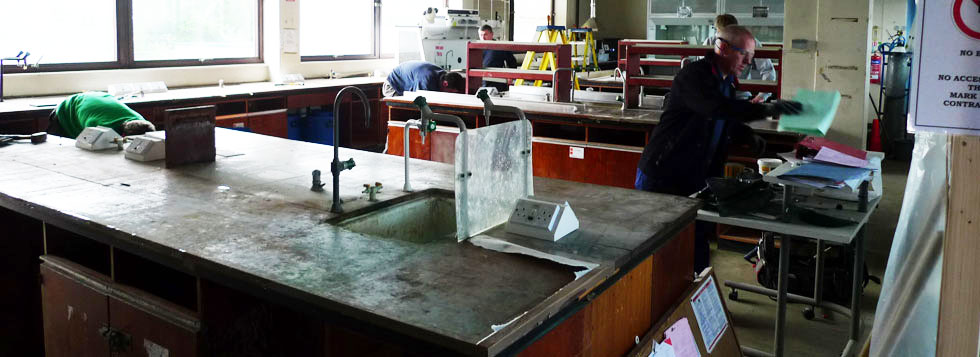
Locate an element on the screen. This screenshot has width=980, height=357. shelves is located at coordinates (562, 80), (635, 66), (620, 61).